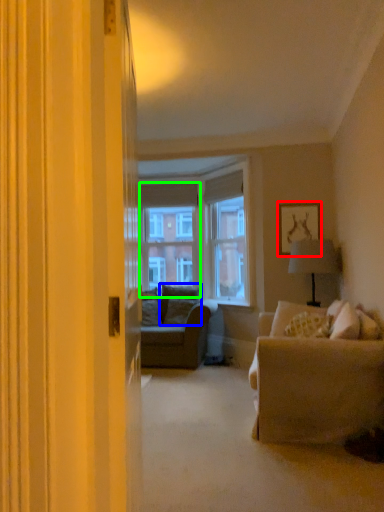
Question: Which object is positioned closest to picture frame (highlighted by a red box)? Select from pillow (highlighted by a blue box) and window screen (highlighted by a green box).

Choices:
 (A) pillow
 (B) window screen

Answer: (A)